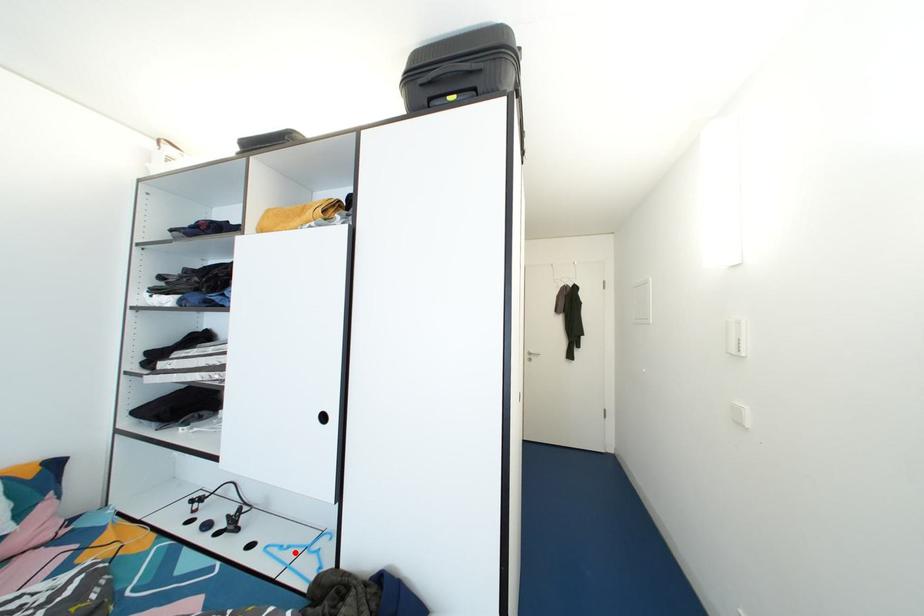
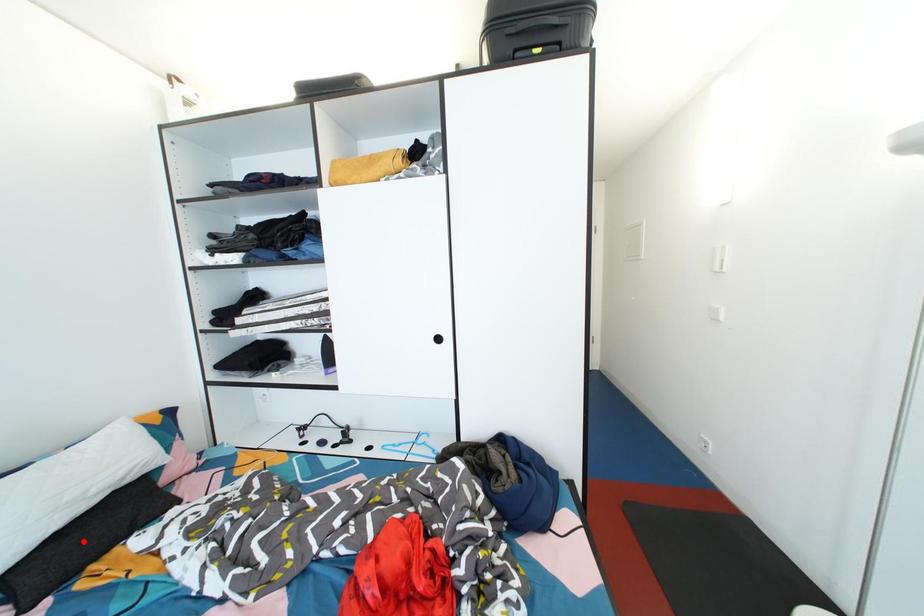
I am providing you with two images of the same scene from different viewpoints. A red point is marked on the first image and another point is marked on the second image. Does the point marked in image1 correspond to the same location as the one in image2?

No